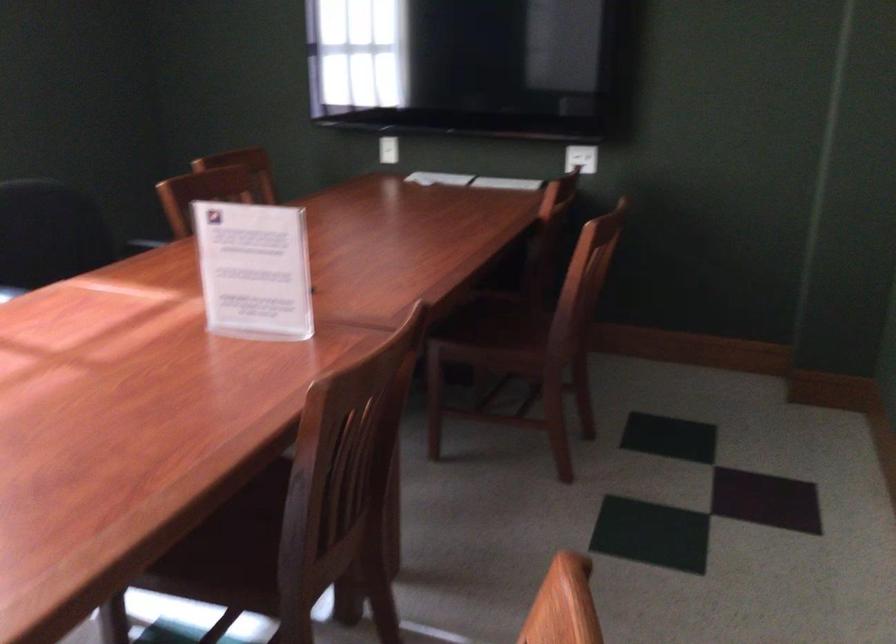
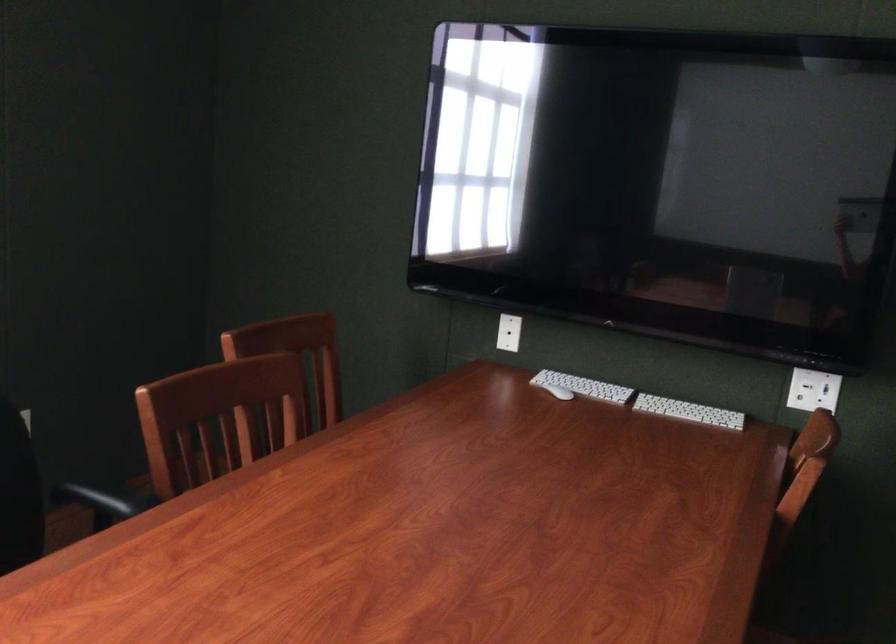
Locate, in the second image, the point that corresponds to point (442, 174) in the first image.

(583, 386)